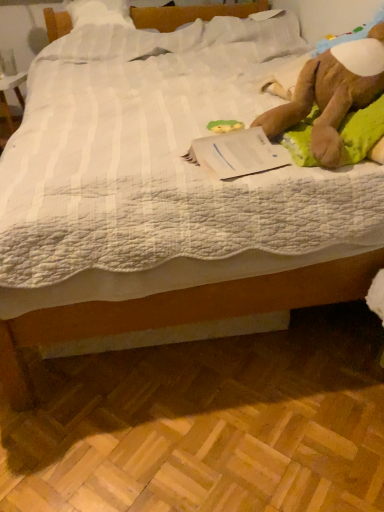
Question: Is brown plush toy at upper right taller or shorter than green rubber duck at center?

Choices:
 (A) tall
 (B) short

Answer: (A)

Question: From a real-world perspective, relative to green rubber duck at center, is brown plush toy at upper right vertically above or below?

Choices:
 (A) below
 (B) above

Answer: (B)

Question: Based on their relative distances, which object is nearer to the white paper at upper right?

Choices:
 (A) brown plush toy at upper right
 (B) green rubber duck at center

Answer: (A)

Question: Estimate the real-world distances between objects in this image. Which object is closer to the green rubber duck at center?

Choices:
 (A) brown plush toy at upper right
 (B) white paper at upper right

Answer: (B)